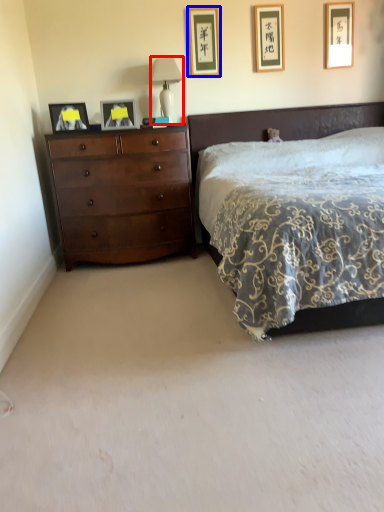
Question: Which of the following is the closest to the observer, table lamp (highlighted by a red box) or picture frame (highlighted by a blue box)?

Choices:
 (A) table lamp
 (B) picture frame

Answer: (A)